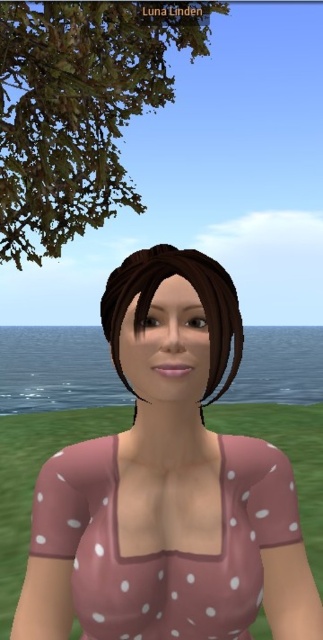
Question: Considering the real-world distances, which object is farthest from the brown matte hair at center?

Choices:
 (A) pink polka dot fabric at center
 (B) pink polka dot dress at center
 (C) green leafy tree at upper left

Answer: (C)

Question: Which point is closer to the camera?

Choices:
 (A) (197, 340)
 (B) (125, 42)
 (C) (235, 355)

Answer: (A)

Question: Estimate the real-world distances between objects in this image. Which object is farther from the green leafy tree at upper left?

Choices:
 (A) brown matte hair at center
 (B) pink polka dot fabric at center
 (C) pink polka dot dress at center

Answer: (A)

Question: In this image, where is pink polka dot fabric at center located relative to brown matte hair at center?

Choices:
 (A) below
 (B) above

Answer: (A)

Question: Does pink polka dot dress at center appear on the left side of brown matte hair at center?

Choices:
 (A) no
 (B) yes

Answer: (B)

Question: Is pink polka dot dress at center to the left of brown matte hair at center from the viewer's perspective?

Choices:
 (A) no
 (B) yes

Answer: (B)